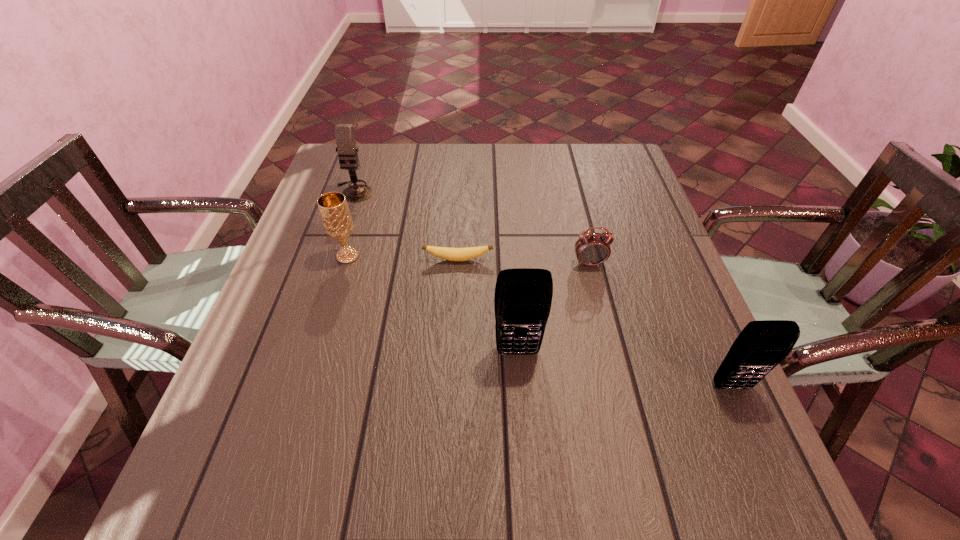
This screenshot has width=960, height=540. I want to click on the left cellular telephone, so click(x=523, y=296).

Find the location of `the farther cellular telephone`. the farther cellular telephone is located at coordinates (523, 296).

This screenshot has height=540, width=960. I want to click on the nearest object, so click(x=762, y=345).

Find the location of a particular element. The height and width of the screenshot is (540, 960). the shorter cellular telephone is located at coordinates [762, 345].

The height and width of the screenshot is (540, 960). In order to click on microphone in this screenshot , I will do `click(344, 133)`.

Image resolution: width=960 pixels, height=540 pixels. I want to click on the fifth tallest object, so click(x=591, y=249).

You are a GUI agent. You are given a task and a screenshot of the screen. Output one action in this format:
    pyautogui.click(x=<x>, y=<y>)
    Task: Click on the alarm clock
    This screenshot has height=540, width=960.
    Given the screenshot: What is the action you would take?
    pyautogui.click(x=591, y=249)

Identify the location of the shortest object. (452, 254).

Identify the location of chalice. (336, 218).

The height and width of the screenshot is (540, 960). I want to click on free space located on the screen of the taller cellular telephone, so (x=522, y=409).